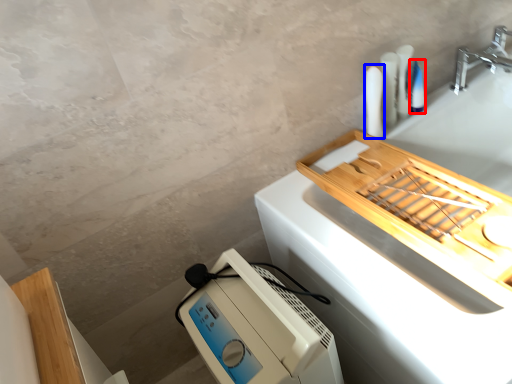
Question: Which of the following is the closest to the observer, toiletry (highlighted by a red box) or toiletry (highlighted by a blue box)?

Choices:
 (A) toiletry
 (B) toiletry

Answer: (B)